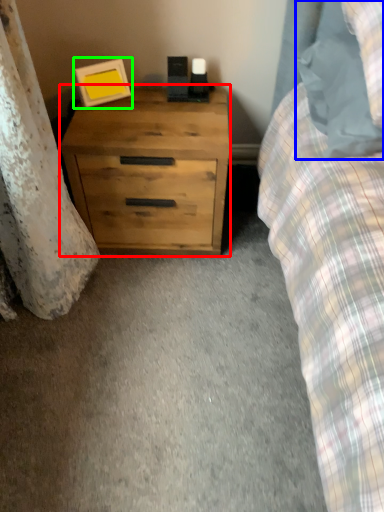
Question: Which object is positioned farthest from chest of drawers (highlighted by a red box)? Select from pillow (highlighted by a blue box) and picture frame (highlighted by a green box).

Choices:
 (A) pillow
 (B) picture frame

Answer: (A)